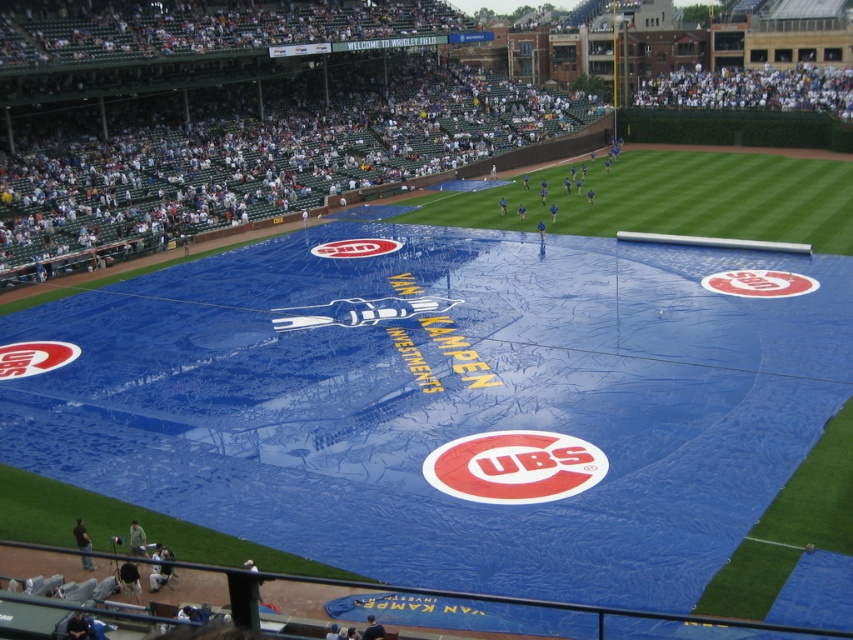
You are a groundskeeper at the baseball stadium and need to locate the Cubs logo on the tarp. The tarp has two notable features at its center. Which feature is positioned lower between the matte red circle at center and the matte white logo at center?

The matte red circle at center is located below the matte white logo at center, so the matte red circle at center is positioned lower.

You are a photographer positioned at the edge of the field. You want to capture both the blue fabric tarp at center and the matte white logo at center in a single shot. Which object should you adjust your camera to focus on first to ensure both are in frame?

The blue fabric tarp at center is to the left of matte white logo at center, so you should focus on the blue fabric tarp at center first to ensure both are in frame.